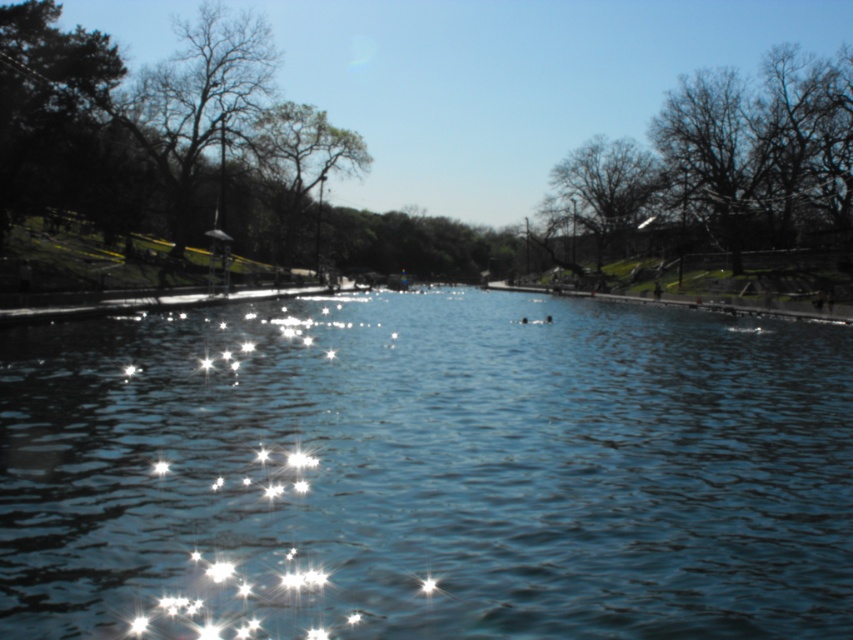
Is point (845, 164) positioned behind point (273, 128)?

That is False.

Which is in front, point (815, 161) or point (346, 138)?

Point (815, 161) is more forward.

Find the location of a particular element. The image size is (853, 640). bare branches at upper right is located at coordinates (722, 164).

Which is above, bare branches at upper right or dark green textured tree at upper center?

bare branches at upper right is higher up.

This screenshot has width=853, height=640. Describe the element at coordinates (722, 164) in the screenshot. I see `bare branches at upper right` at that location.

Where is `bare branches at upper right`? bare branches at upper right is located at coordinates (722, 164).

Does blue reflective water at center have a lesser width compared to dark green textured tree at upper center?

No.

Can you confirm if blue reflective water at center is bigger than dark green textured tree at upper center?

Actually, blue reflective water at center might be smaller than dark green textured tree at upper center.

Find the location of a particular element. blue reflective water at center is located at coordinates (428, 470).

This screenshot has width=853, height=640. Find the location of `blue reflective water at center`. blue reflective water at center is located at coordinates (428, 470).